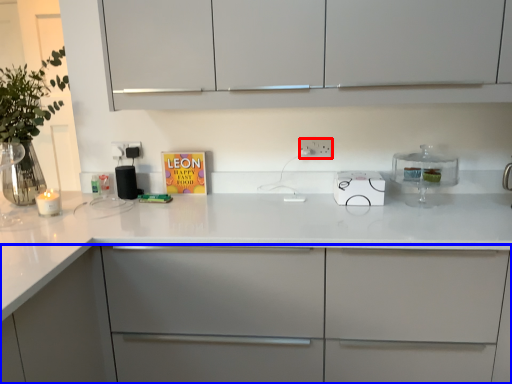
Question: Which object is closer to the camera taking this photo, electric outlet (highlighted by a red box) or cabinetry (highlighted by a blue box)?

Choices:
 (A) electric outlet
 (B) cabinetry

Answer: (B)